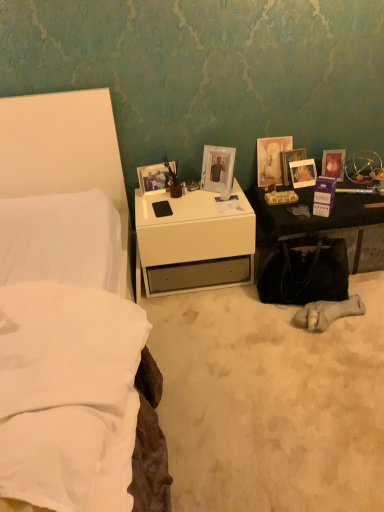
Question: Are white soft pillow at left and white glossy picture frame at center, the second picture frame in the left-to-right sequence, beside each other?

Choices:
 (A) no
 (B) yes

Answer: (A)

Question: Considering the relative sizes of white soft pillow at left and white glossy picture frame at center, the second picture frame in the left-to-right sequence, in the image provided, is white soft pillow at left wider than white glossy picture frame at center, the second picture frame in the left-to-right sequence,?

Choices:
 (A) no
 (B) yes

Answer: (B)

Question: Would you say white soft pillow at left contains white glossy picture frame at center, positioned as the 5th picture frame in right-to-left order?

Choices:
 (A) no
 (B) yes

Answer: (A)

Question: Is white soft pillow at left closer to the viewer compared to white glossy picture frame at center, positioned as the 5th picture frame in right-to-left order?

Choices:
 (A) no
 (B) yes

Answer: (B)

Question: Is white soft pillow at left taller than white glossy picture frame at center, the second picture frame in the left-to-right sequence?

Choices:
 (A) no
 (B) yes

Answer: (A)

Question: From the image's perspective, is white soft pillow at left below white glossy picture frame at center, the second picture frame in the left-to-right sequence?

Choices:
 (A) no
 (B) yes

Answer: (B)

Question: Can you confirm if white fabric bed at upper left is positioned to the left of black leather handbag at lower right?

Choices:
 (A) yes
 (B) no

Answer: (A)

Question: Can you confirm if white fabric bed at upper left is positioned to the right of black leather handbag at lower right?

Choices:
 (A) yes
 (B) no

Answer: (B)

Question: Does white fabric bed at upper left contain black leather handbag at lower right?

Choices:
 (A) yes
 (B) no

Answer: (B)

Question: Is white fabric bed at upper left beside black leather handbag at lower right?

Choices:
 (A) no
 (B) yes

Answer: (A)

Question: From a real-world perspective, is white fabric bed at upper left physically above black leather handbag at lower right?

Choices:
 (A) no
 (B) yes

Answer: (B)

Question: Can you confirm if white fabric bed at upper left is taller than black leather handbag at lower right?

Choices:
 (A) yes
 (B) no

Answer: (A)

Question: From the image's perspective, does matte glass picture frame at upper right, which is the third picture frame from left to right, appear lower than white fabric bed at upper left?

Choices:
 (A) no
 (B) yes

Answer: (A)